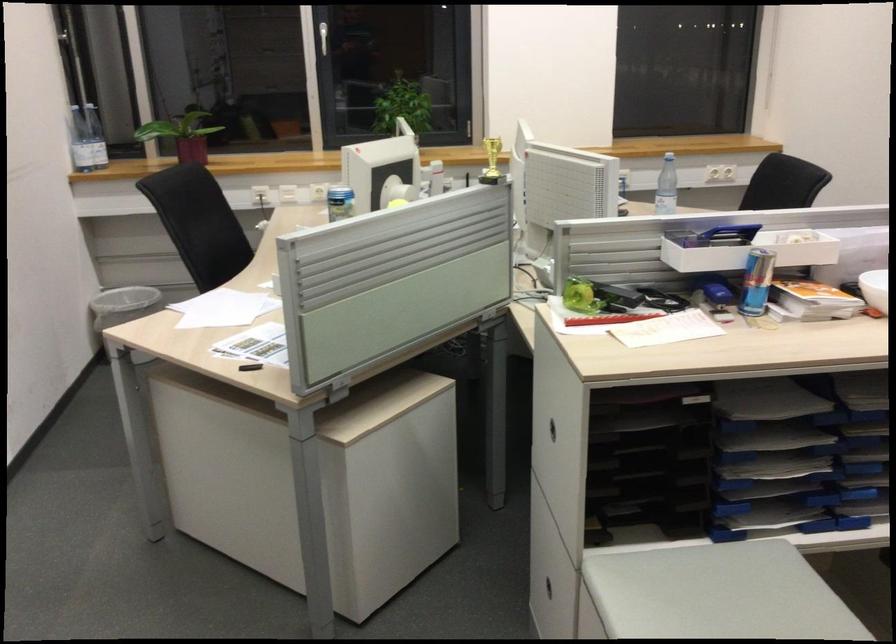
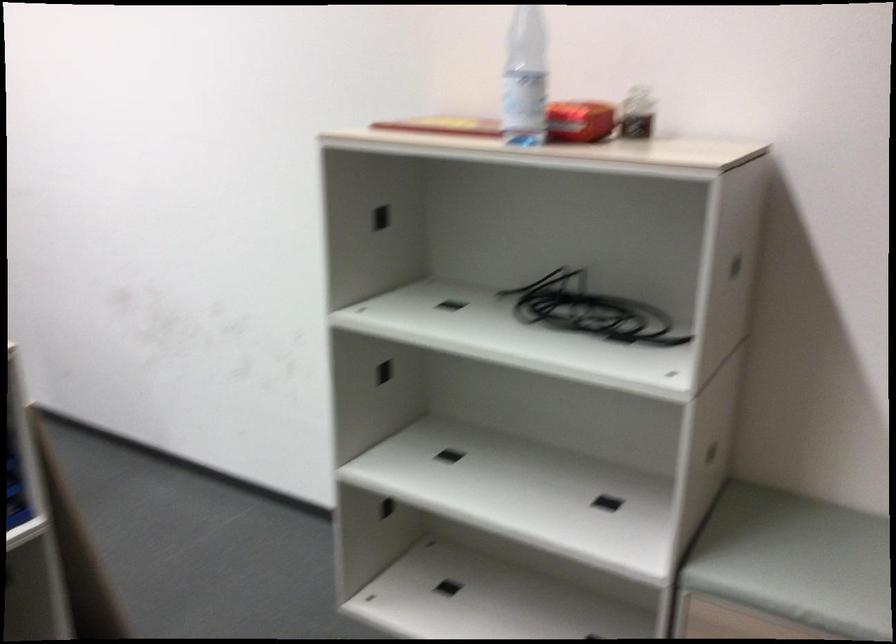
Question: The camera is either moving clockwise (left) or counter-clockwise (right) around the object. The first image is from the beginning of the video and the second image is from the end. Is the camera moving left or right when shooting the video?

Choices:
 (A) Left
 (B) Right

Answer: (A)